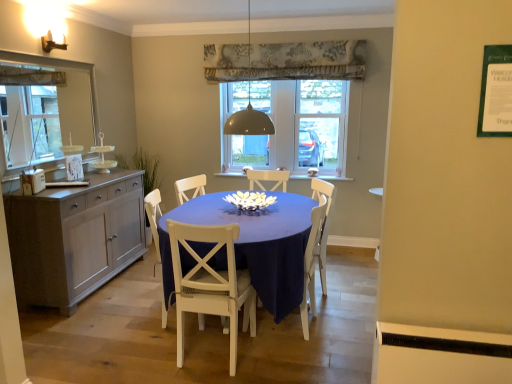
Question: From the image's perspective, is transparent glass door at center, marked as the second glass door in a left-to-right arrangement, located above or below white wood chair at center, the 2th chair in the left-to-right sequence?

Choices:
 (A) below
 (B) above

Answer: (B)

Question: In terms of width, does transparent glass door at center, the 1th glass door viewed from the right, look wider or thinner when compared to white wood chair at center, arranged as the 2th chair when viewed from the right?

Choices:
 (A) thin
 (B) wide

Answer: (A)

Question: Which of these objects is positioned closest to the matte glass mirror at left?

Choices:
 (A) matte white table at center
 (B) matte gray cabinet at left
 (C) clear glass door at center, which is the 2th glass door from right to left
 (D) white wood chair at center, which is the 3th chair in left-to-right order
 (E) white wood chair at center, which ranks as the third chair in right-to-left order

Answer: (B)

Question: Considering the real-world distances, which object is farthest from the matte gray cabinet at left?

Choices:
 (A) transparent glass door at center, the 1th glass door viewed from the right
 (B) matte glass mirror at left
 (C) matte gray dome at center
 (D) white wood chair at center, arranged as the 2th chair when viewed from the right
 (E) wooden picture frame at left

Answer: (A)